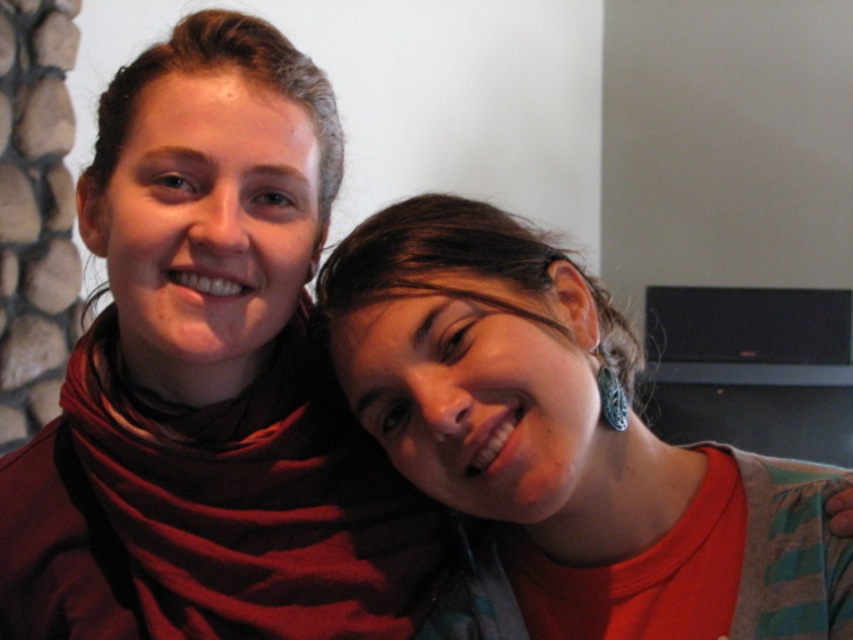
Is matte red scarf at upper left shorter than teal earrings at upper right?

No, matte red scarf at upper left is not shorter than teal earrings at upper right.

Between matte red scarf at upper left and teal earrings at upper right, which one has less height?

With less height is teal earrings at upper right.

Between point (291, 518) and point (462, 346), which one is positioned in front?

Positioned in front is point (462, 346).

The height and width of the screenshot is (640, 853). I want to click on matte red scarf at upper left, so click(209, 381).